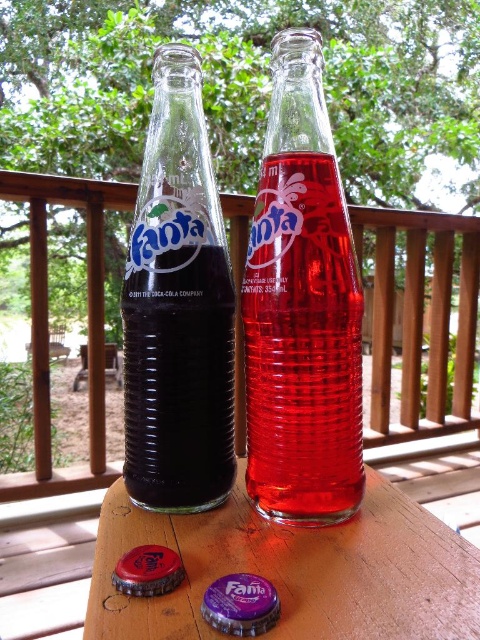
You are trying to stack the purple matte bottle cap at lower center and the brushed metal bottle cap at lower left on top of each other. Which cap should you place at the bottom to ensure stability?

The brushed metal bottle cap at lower left should be placed at the bottom because it is thicker than the purple matte bottle cap at lower center, providing a more stable base for stacking.

You are sitting at the wooden picnic table at center and want to grab the brushed metal bottle cap at lower left. Is the bottle cap within easy reach from your current position?

The brushed metal bottle cap at lower left is closer to the viewer than the wooden picnic table at center, so yes, the bottle cap is within easy reach from your current position at the wooden picnic table at center.

You are a delivery person who needs to place a new bottle cap at the same position as the existing brushed metal bottle cap at lower left. What are the coordinates where you should place the new cap?

The coordinates for the brushed metal bottle cap at lower left are at point (147,572).